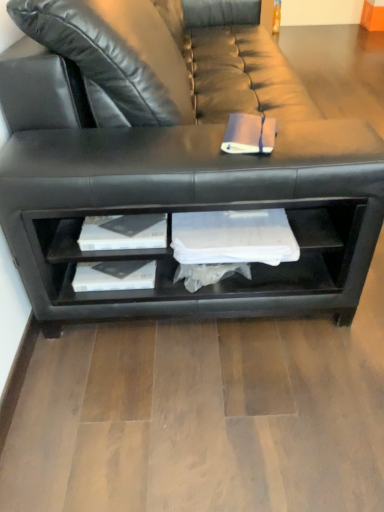
Image resolution: width=384 pixels, height=512 pixels. In order to click on free space in front of pink matte book at center in this screenshot , I will do `click(258, 175)`.